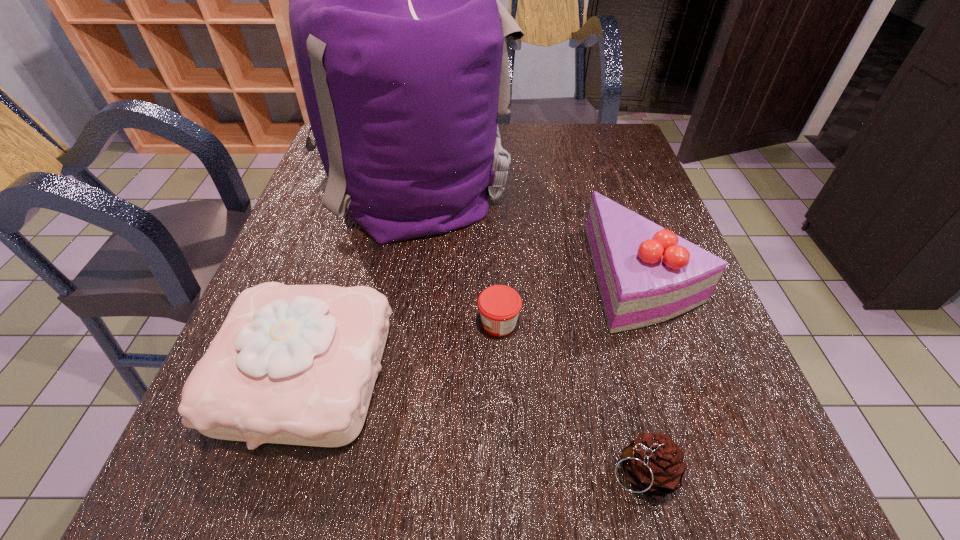
Identify the location of empty space between the shortest object and the left cake. (402, 348).

This screenshot has width=960, height=540. What are the coordinates of `vacant area that lies between the jam and the left cake` in the screenshot? It's located at (402, 348).

Where is `free area in between the shorter cake and the shortest object`? free area in between the shorter cake and the shortest object is located at coordinates (402, 348).

Where is `vacant area between the jam and the backpack`? vacant area between the jam and the backpack is located at coordinates (455, 251).

This screenshot has height=540, width=960. I want to click on vacant point located between the taller cake and the second shortest object, so click(642, 374).

Locate an element on the screen. vacant point located between the fourth tallest object and the shortest object is located at coordinates click(569, 397).

Locate an element on the screen. free space between the backpack and the second tallest object is located at coordinates (528, 228).

Where is `blank region between the left cake and the right cake`? blank region between the left cake and the right cake is located at coordinates (474, 325).

Locate an element on the screen. vacant area that lies between the pinecone and the right cake is located at coordinates (642, 374).

This screenshot has height=540, width=960. Identify the location of object that is the second closest one to the backpack. (499, 305).